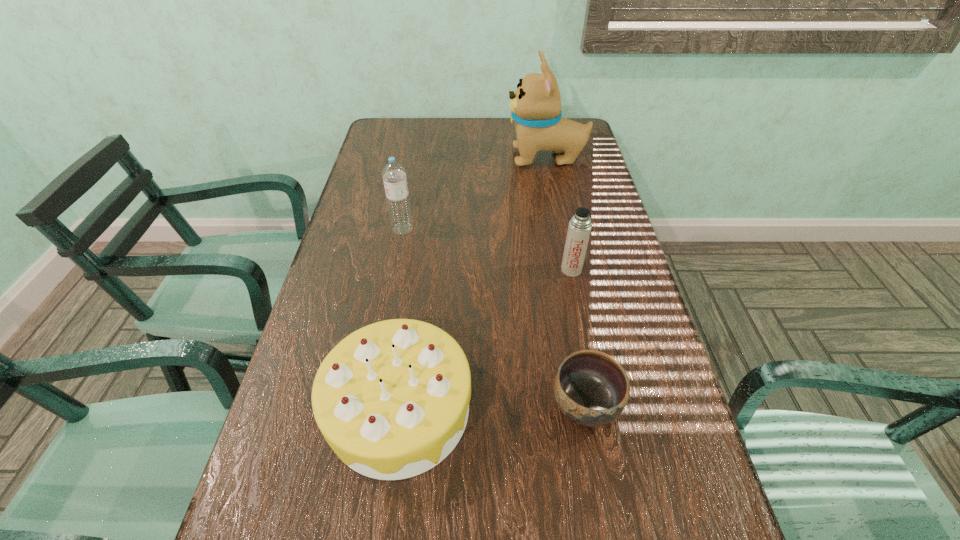
You are a GUI agent. You are given a task and a screenshot of the screen. Output one action in this format:
    pyautogui.click(x=<x>, y=<y>)
    Task: Click on the vacant space situated 0.230m on the back of the water bottle
    Image resolution: width=960 pixels, height=540 pixels.
    Given the screenshot: What is the action you would take?
    pyautogui.click(x=413, y=178)

Identify the location of free location located 0.250m on the back of the thermos bottle. (559, 205).

Where is `vacant space located on the back of the birthday cake`? The height and width of the screenshot is (540, 960). vacant space located on the back of the birthday cake is located at coordinates (422, 245).

Find the location of a particular element. vacant region located on the left of the shortest object is located at coordinates (456, 404).

What are the coordinates of `object at the far edge` in the screenshot? It's located at (535, 107).

This screenshot has width=960, height=540. Find the location of `water bottle that is at the left edge`. water bottle that is at the left edge is located at coordinates (394, 174).

At what (x,y) coordinates should I click in order to perform the action: click on birthday cake situated at the left edge. Please return your answer as a coordinate pair (x, y). This screenshot has width=960, height=540. Looking at the image, I should click on (391, 399).

At what (x,y) coordinates should I click in order to perform the action: click on puppy located in the right edge section of the desktop. Please return your answer as a coordinate pair (x, y). The width and height of the screenshot is (960, 540). Looking at the image, I should click on (535, 107).

Where is `thermos bottle situated at the right edge`? thermos bottle situated at the right edge is located at coordinates (579, 228).

Identify the location of bowl present at the right edge. (591, 388).